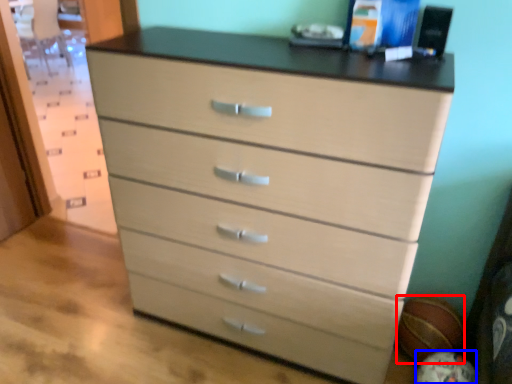
Question: Which point is further to the camera, basketball (highlighted by a red box) or basketball (highlighted by a blue box)?

Choices:
 (A) basketball
 (B) basketball

Answer: (A)